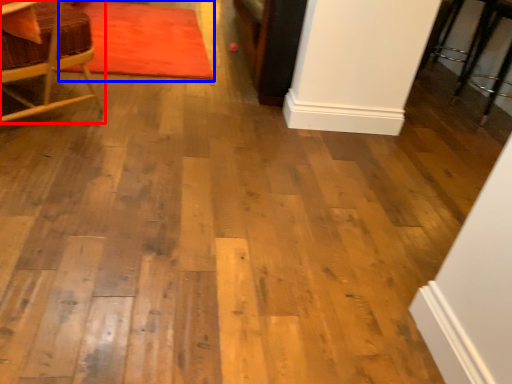
Question: Which of the following is the farthest to the observer, chair (highlighted by a red box) or mat (highlighted by a blue box)?

Choices:
 (A) chair
 (B) mat

Answer: (B)